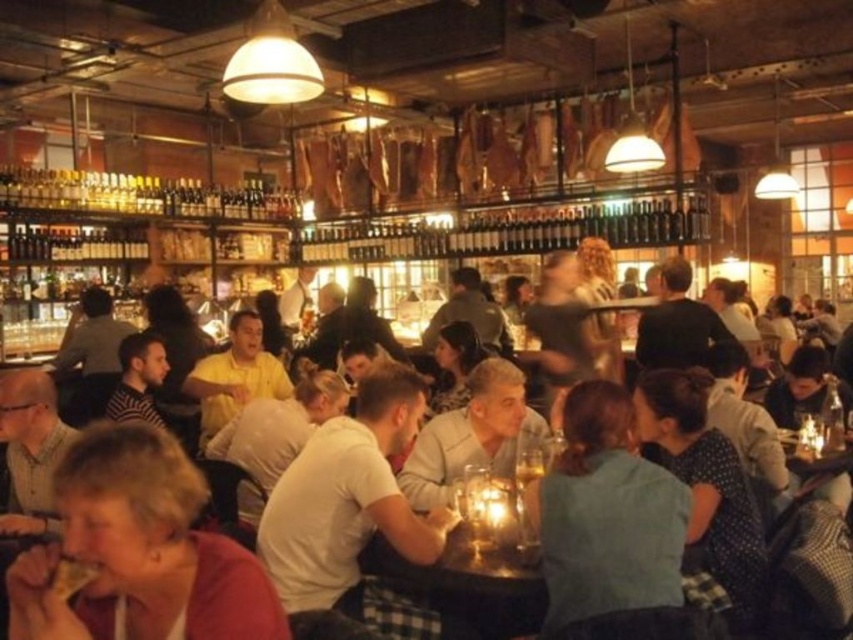
You are a photographer setting up a shoot in this bar. You need to decide which of the two subjects wearing the matte red shirt at lower left and green fabric shirt at center will require a wider camera frame due to the size of their clothing. Which one should you adjust your camera settings for?

The matte red shirt at lower left requires a wider camera frame because its width is larger than the green fabric shirt at center.